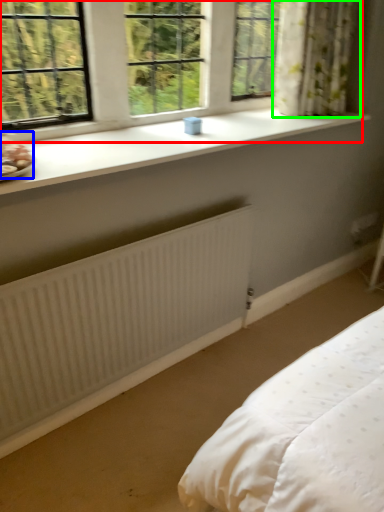
Question: Based on their relative distances, which object is nearer to window (highlighted by a red box)? Choose from food (highlighted by a blue box) and curtain (highlighted by a green box).

Choices:
 (A) food
 (B) curtain

Answer: (A)